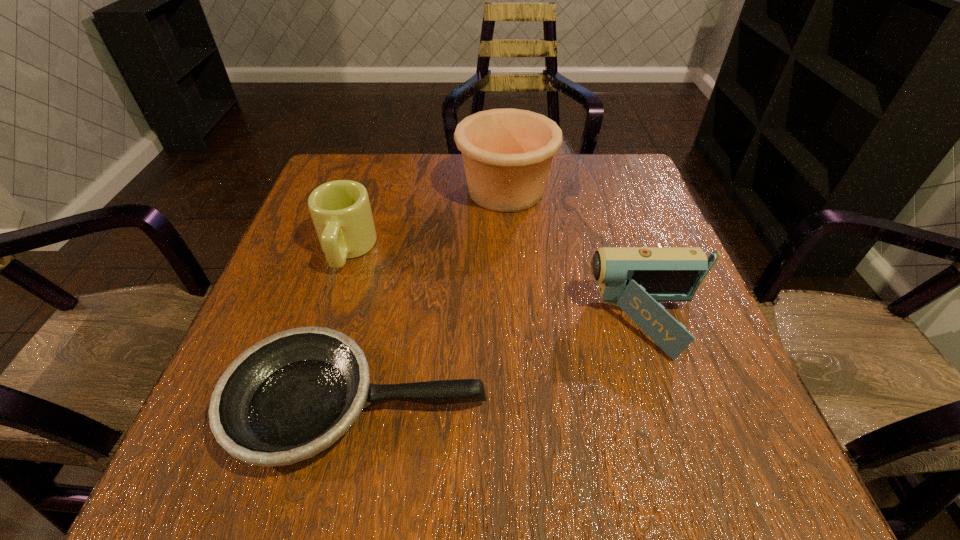
At what (x,y) coordinates should I click in order to perform the action: click on free space located on the handle side of the frying pan. Please return your answer as a coordinate pair (x, y). Looking at the image, I should click on (611, 404).

Image resolution: width=960 pixels, height=540 pixels. I want to click on object present at the far edge, so click(507, 153).

This screenshot has height=540, width=960. I want to click on object present at the near edge, so click(288, 397).

Where is `mug at the left edge`? mug at the left edge is located at coordinates (340, 210).

Find the location of a particular element. The height and width of the screenshot is (540, 960). frying pan that is at the left edge is located at coordinates (288, 397).

Where is `object situated at the right edge`? object situated at the right edge is located at coordinates (635, 279).

The height and width of the screenshot is (540, 960). In order to click on object that is at the near left corner in this screenshot , I will do `click(288, 397)`.

Find the location of a particular element. free space at the far edge of the desktop is located at coordinates (561, 164).

Find the location of `vacant space at the near edge of the desktop`. vacant space at the near edge of the desktop is located at coordinates (403, 485).

You are a GUI agent. You are given a task and a screenshot of the screen. Output one action in this format:
    pyautogui.click(x=<x>, y=<y>)
    Task: Click on the free space at the left edge
    
    Given the screenshot: What is the action you would take?
    [x=249, y=327]